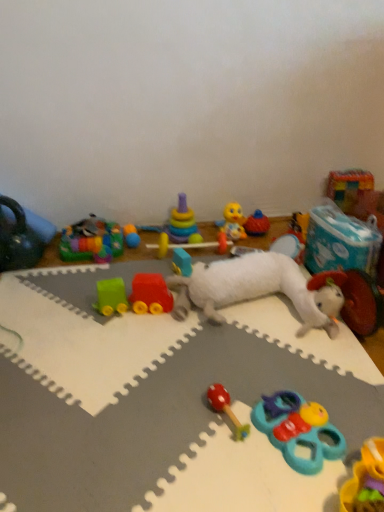
The height and width of the screenshot is (512, 384). Find the location of `vacant space behind smooth red wooden rattle at center, the 9th toy in the right-to-left sequence`. vacant space behind smooth red wooden rattle at center, the 9th toy in the right-to-left sequence is located at coordinates (223, 367).